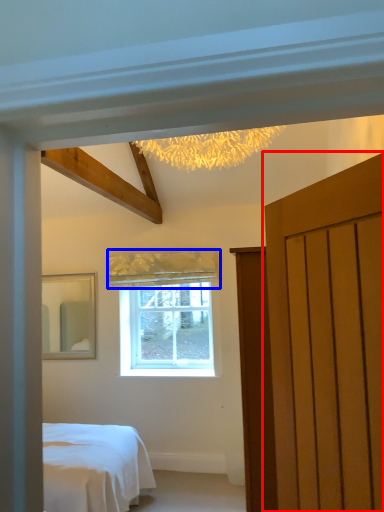
Question: Which of the following is the closest to the observer, door (highlighted by a red box) or curtain (highlighted by a blue box)?

Choices:
 (A) door
 (B) curtain

Answer: (A)